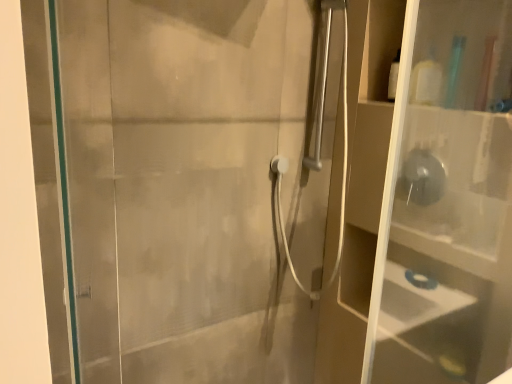
Question: From the image's perspective, relative to transparent plastic shelf at right, is white matte bottle at upper right above or below?

Choices:
 (A) below
 (B) above

Answer: (B)

Question: Choose the correct answer: Is white matte bottle at upper right inside transparent plastic shelf at right or outside it?

Choices:
 (A) inside
 (B) outside

Answer: (B)

Question: Which is farther from the white matte bottle at upper right?

Choices:
 (A) transparent plastic shelf at right
 (B) transparent glass screen door at left

Answer: (B)

Question: Considering the real-world distances, which object is closest to the transparent plastic shelf at right?

Choices:
 (A) white matte bottle at upper right
 (B) transparent glass screen door at left

Answer: (A)